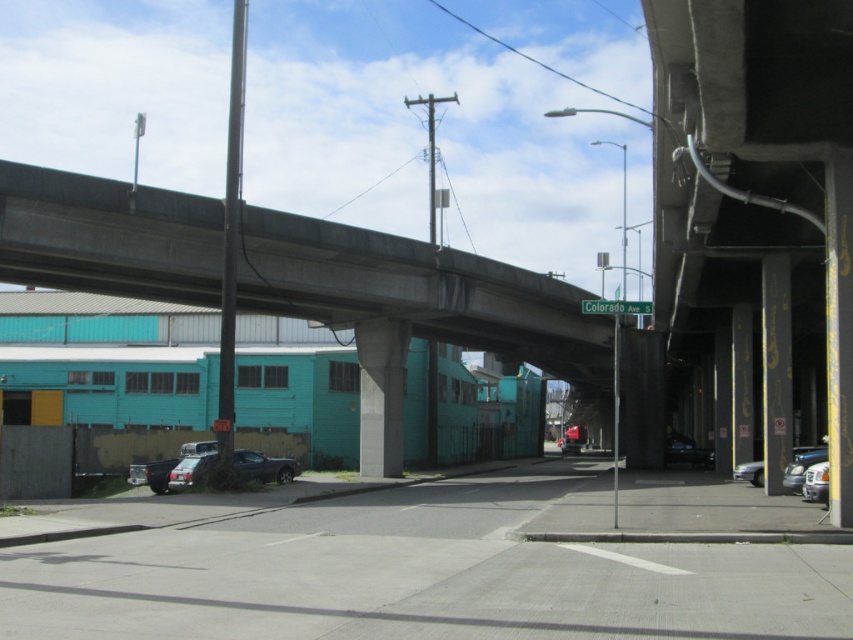
You are a pedestrian standing at the center of Colorado Ave S. You see a satin black truck at lower left and a silver metallic car at lower right. Which vehicle is closer to the street sign labeled Colorado Ave S?

The satin black truck at lower left is closer to the street sign labeled Colorado Ave S because it is positioned to the left of the silver metallic car at lower right, and the street sign is located on the street below the overpass which is in the center.

You are a pedestrian standing at the base of the overpass and want to cross the street to reach the teal buildings on the left. There are two cars nearby. The silver metallic sedan at lower right and the metallic silver car at center. Given that the crosswalk is 100 meters away from your current position, will both cars be within the crosswalk area when you start crossing?

The silver metallic sedan at lower right and metallic silver car at center are 100.78 meters apart. Since the crosswalk is 100 meters away, the metallic silver car at center is slightly beyond the crosswalk area, while the silver metallic sedan at lower right is within the crosswalk area.

In the scene shown: You are a delivery driver needing to pass under the concrete bridge at upper center with a truck that is 4.5 meters tall. Can you safely pass under the bridge without hitting the shiny black sedan at center?

The concrete bridge at upper center and shiny black sedan at center are 13.40 meters apart. Since the truck is only 4.5 meters tall, the height is sufficient to pass under the bridge safely as long as there are no other obstructions. The distance between the bridge and the sedan does not affect the height clearance.